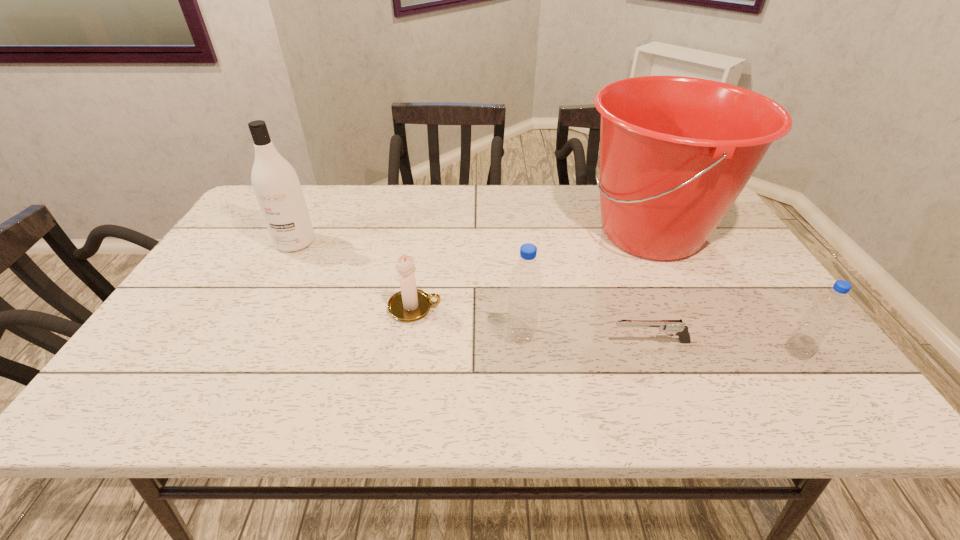
The height and width of the screenshot is (540, 960). Identify the location of the fourth shortest object. (526, 278).

Locate an element on the screen. the left water bottle is located at coordinates (526, 278).

I want to click on the fourth tallest object, so click(827, 308).

Locate an element on the screen. the shorter water bottle is located at coordinates (827, 308).

The width and height of the screenshot is (960, 540). Find the location of `bucket`. bucket is located at coordinates (676, 152).

Identify the location of the leftmost object. (275, 183).

The image size is (960, 540). In order to click on the second shortest object in this screenshot , I will do `click(410, 304)`.

Locate an element on the screen. The image size is (960, 540). candle holder is located at coordinates (410, 304).

Where is `pistol`? This screenshot has width=960, height=540. pistol is located at coordinates (676, 326).

Identify the location of blank space located on the back of the fourth shortest object. The width and height of the screenshot is (960, 540). click(x=514, y=253).